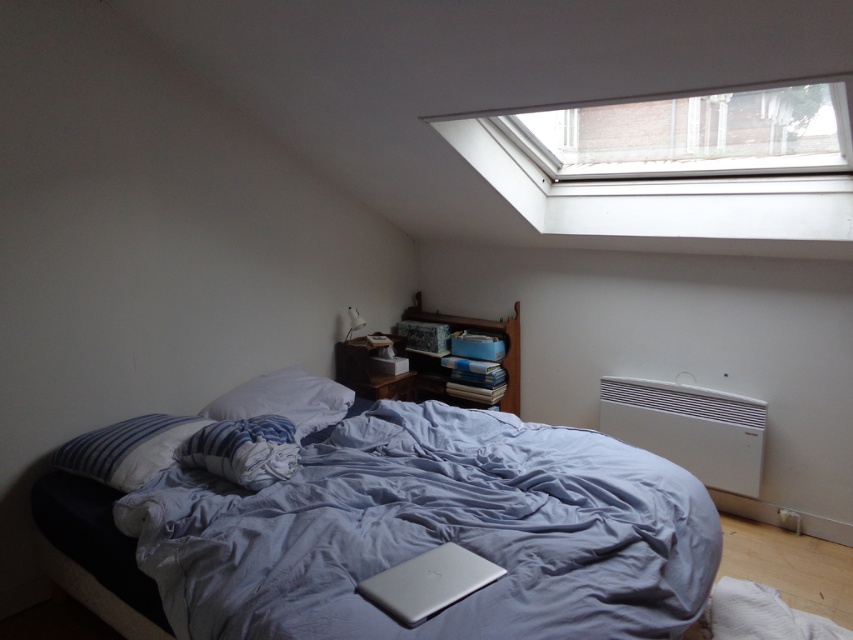
Question: Does transparent glass window at upper center appear on the right side of white striped pillow at lower left?

Choices:
 (A) no
 (B) yes

Answer: (B)

Question: Does transparent glass window at upper center have a larger size compared to white soft pillow at center?

Choices:
 (A) no
 (B) yes

Answer: (B)

Question: Which point is closer to the camera?

Choices:
 (A) (421, 620)
 (B) (527, 116)

Answer: (A)

Question: Which is nearer to the white striped pillow at lower left?

Choices:
 (A) blue cotton bedsheet at center
 (B) silver metallic laptop at lower center

Answer: (A)

Question: Is silver metallic laptop at lower center smaller than white soft pillow at center?

Choices:
 (A) yes
 (B) no

Answer: (A)

Question: Which of the following is the closest to the observer?

Choices:
 (A) (299, 432)
 (B) (422, 586)
 (C) (160, 458)

Answer: (B)